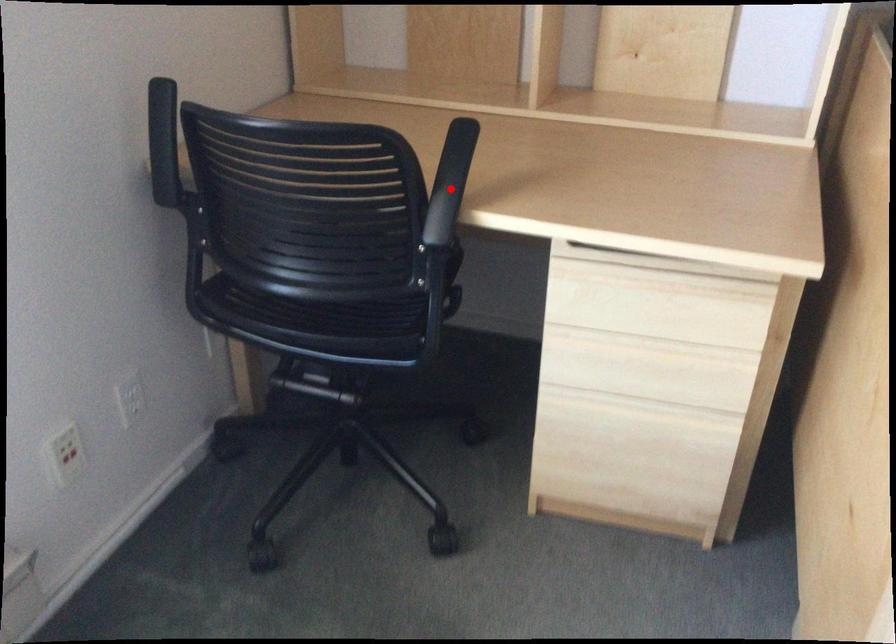
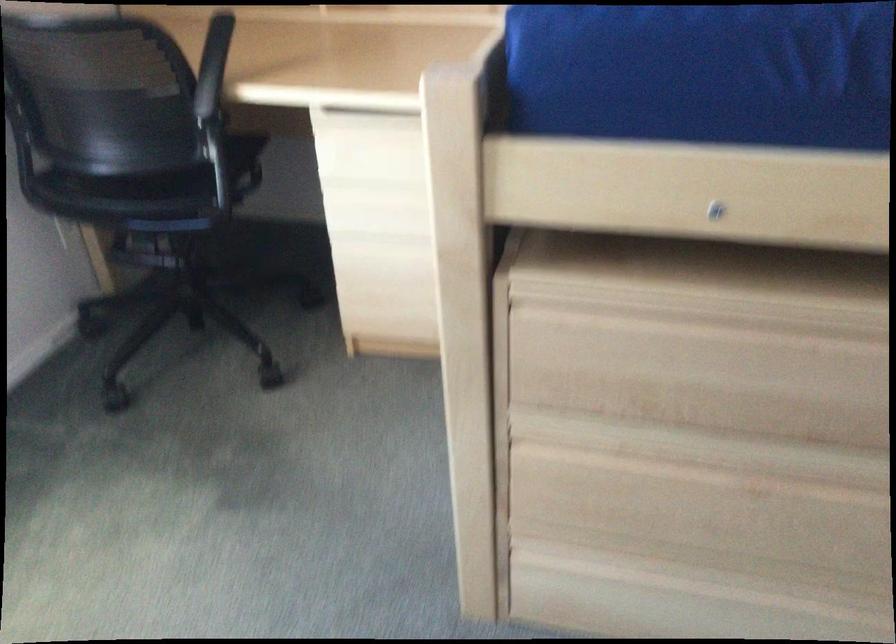
The point at the highlighted location is marked in the first image. Where is the corresponding point in the second image?

(212, 66)